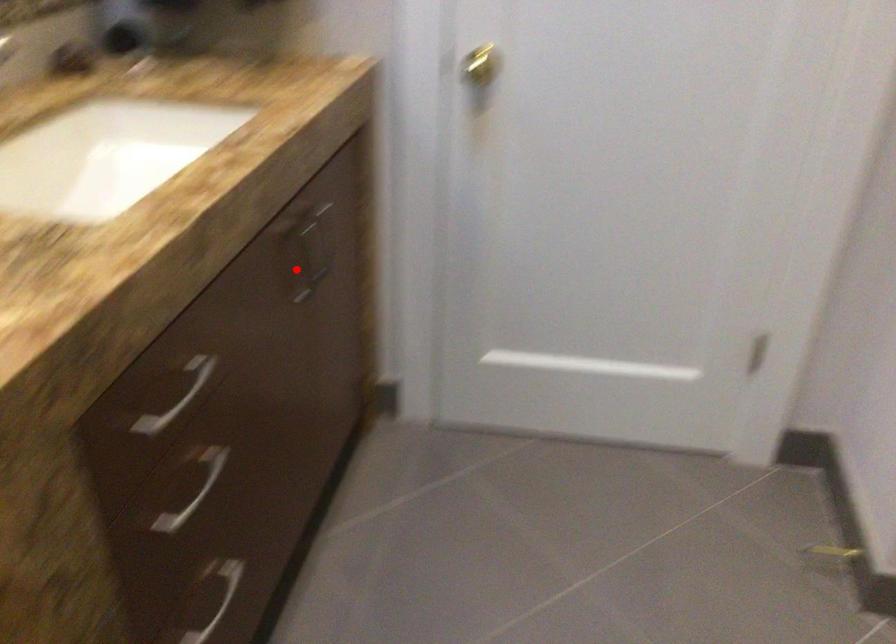
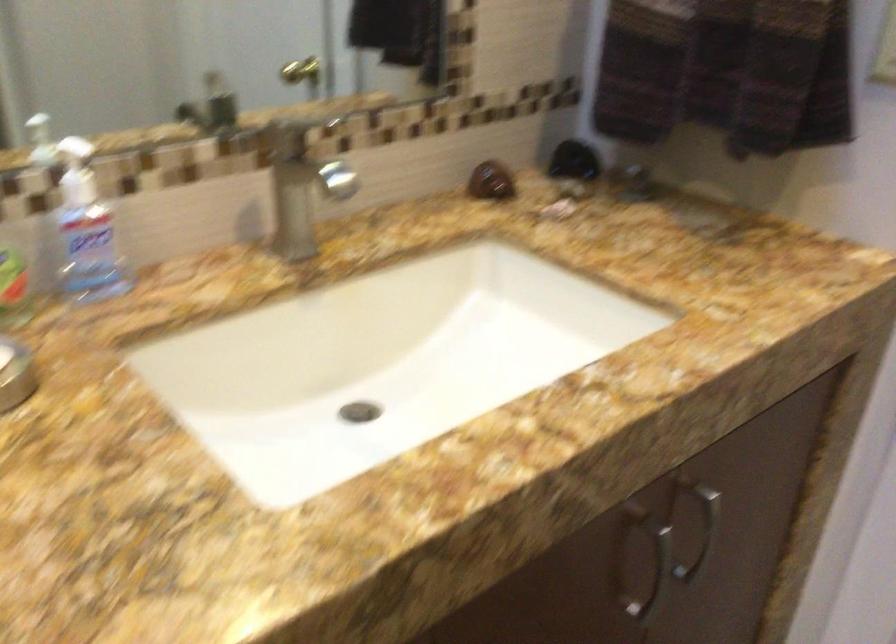
Where in the second image is the point corresponding to the highlighted location from the first image?

(642, 565)